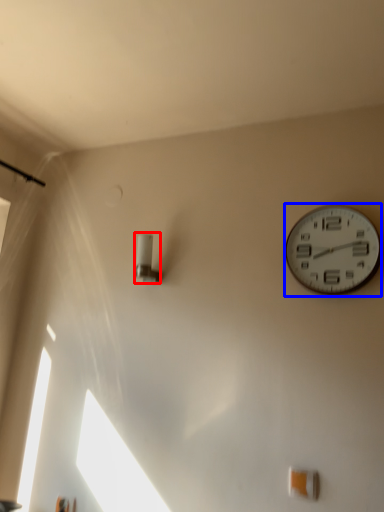
Question: Among these objects, which one is farthest to the camera, light fixture (highlighted by a red box) or wall clock (highlighted by a blue box)?

Choices:
 (A) light fixture
 (B) wall clock

Answer: (A)